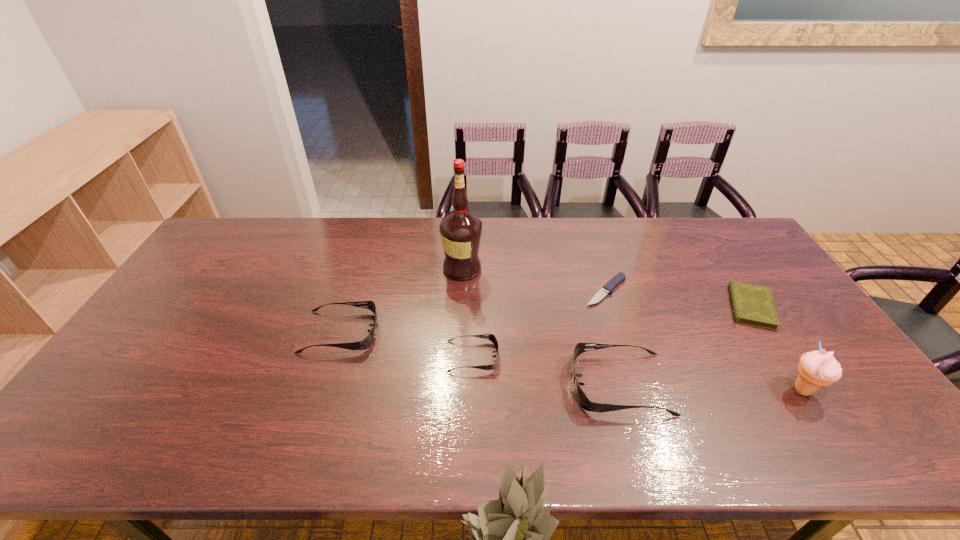
Please point a vacant point for placing a sunglasses on the right. Please provide its 2D coordinates. Your answer should be formatted as a tuple, i.e. [(x, y)], where the tuple contains the x and y coordinates of a point satisfying the conditions above.

[(785, 415)]